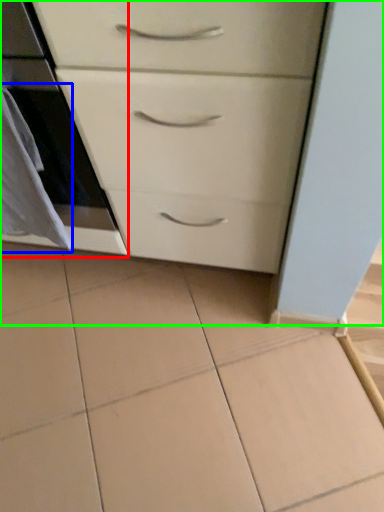
Question: Based on their relative distances, which object is farther from oven (highlighted by a red box)? Choose from material (highlighted by a blue box) and chest of drawers (highlighted by a green box).

Choices:
 (A) material
 (B) chest of drawers

Answer: (B)